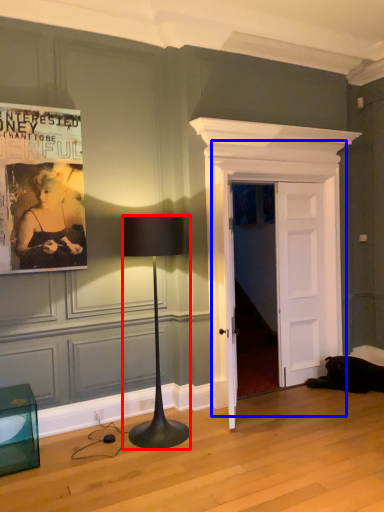
Question: Which point is further to the camera, lamp (highlighted by a red box) or door (highlighted by a blue box)?

Choices:
 (A) lamp
 (B) door

Answer: (B)